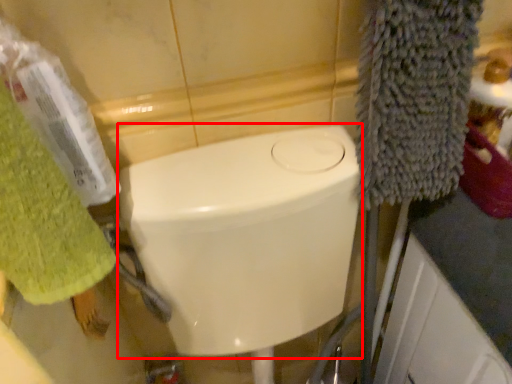
Question: From the image's perspective, where is bidet (annotated by the red box) located relative to towel/napkin?

Choices:
 (A) above
 (B) below

Answer: (B)